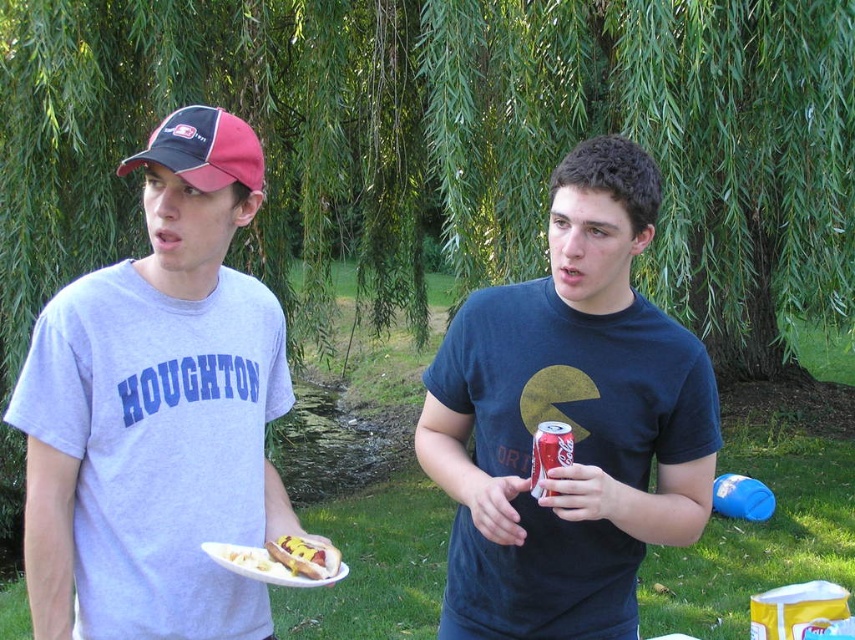
Question: Is the position of shiny red can at center more distant than that of yellow mustard-covered hot dog at lower left?

Choices:
 (A) no
 (B) yes

Answer: (A)

Question: Is gray cotton t-shirt at left to the left of coke can at center from the viewer's perspective?

Choices:
 (A) no
 (B) yes

Answer: (B)

Question: Does black and pink baseball cap at left appear on the right side of white paper plate at lower center?

Choices:
 (A) no
 (B) yes

Answer: (A)

Question: Which point is farther to the camera?

Choices:
 (A) (246, 570)
 (B) (180, 141)
 (C) (52, 406)
 (D) (276, 572)

Answer: (D)

Question: Which object is positioned farthest from the shiny red can at center?

Choices:
 (A) coke can at center
 (B) white paper plate at lower center

Answer: (B)

Question: Which is nearer to the shiny red can at center?

Choices:
 (A) yellow mustard-covered hot dog at lower left
 (B) black and pink baseball cap at left
 (C) gray cotton t-shirt at left

Answer: (A)